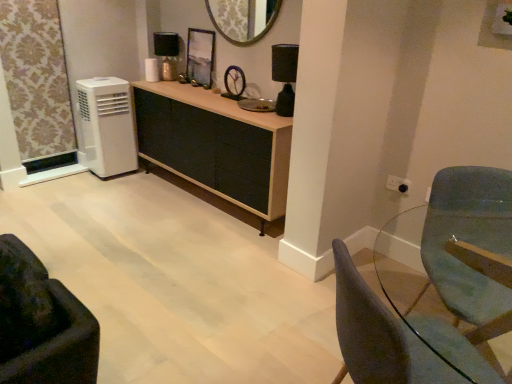
This screenshot has height=384, width=512. In order to click on free space in front of metallic gold lamp at upper center, the second lamp ordered from the bottom in this screenshot , I will do `click(165, 84)`.